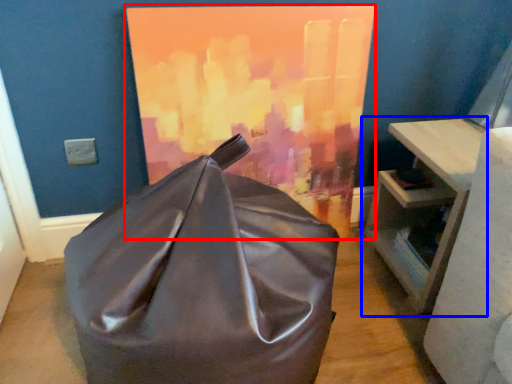
Question: Which object appears farthest to the camera in this image, oil painting (highlighted by a red box) or table (highlighted by a blue box)?

Choices:
 (A) oil painting
 (B) table

Answer: (B)